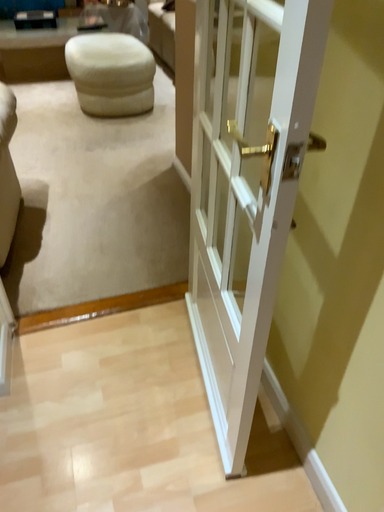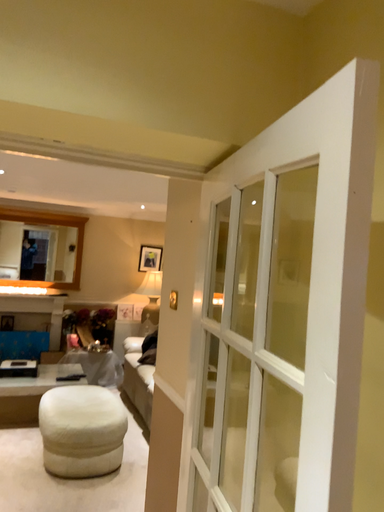
Question: Which way did the camera rotate in the video?

Choices:
 (A) rotated downward
 (B) rotated upward

Answer: (B)